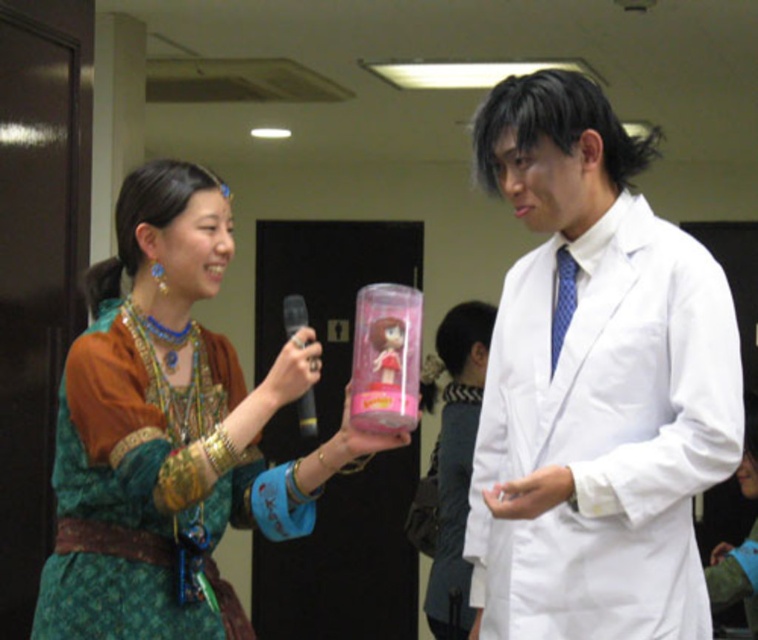
You are a fashion designer observing the two individuals in the scene. You need to determine which garment would require more fabric to create. Based on the image, which item would need more material between the white smooth lab coat at right and the green velvet dress at lower right?

The white smooth lab coat at right has a larger size compared to the green velvet dress at lower right, so it would require more fabric to create.

You are a photographer standing in the hallway and need to take a photo of both the white smooth lab coat at right and the green velvet dress at lower right. Considering the distance between them, will they both fit in your camera frame if your camera has a maximum field of view of 4 feet?

The white smooth lab coat at right and green velvet dress at lower right are 3.99 feet apart, so yes, they will both fit in the camera frame since the distance between them is just under the 4 feet maximum field of view.